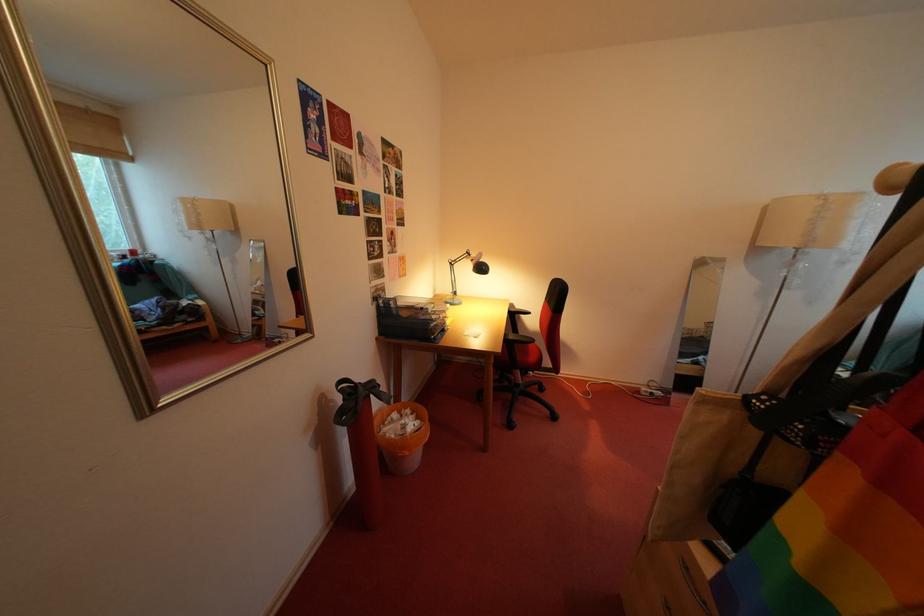
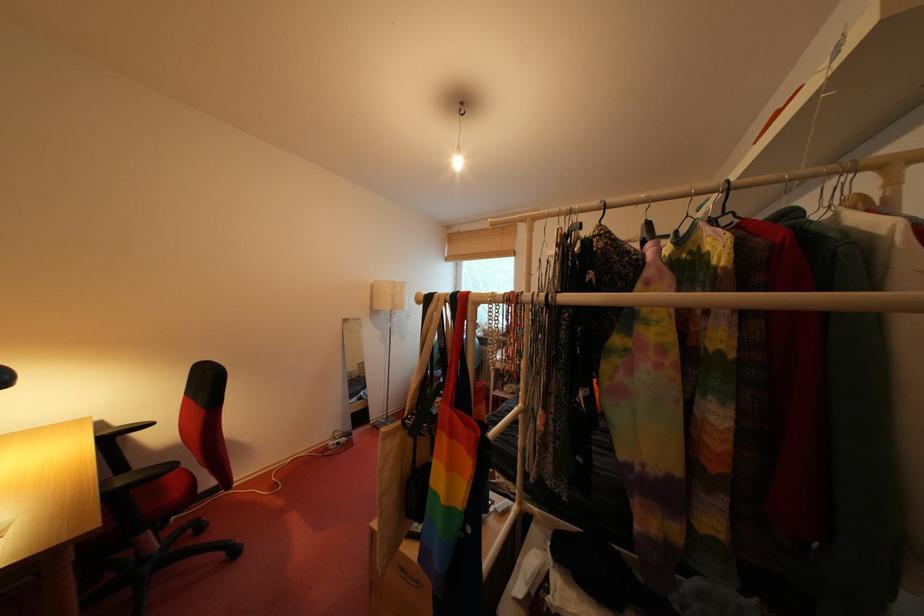
Question: The camera is either moving clockwise (left) or counter-clockwise (right) around the object. The first image is from the beginning of the video and the second image is from the end. Is the camera moving left or right when shooting the video?

Choices:
 (A) Left
 (B) Right

Answer: (A)